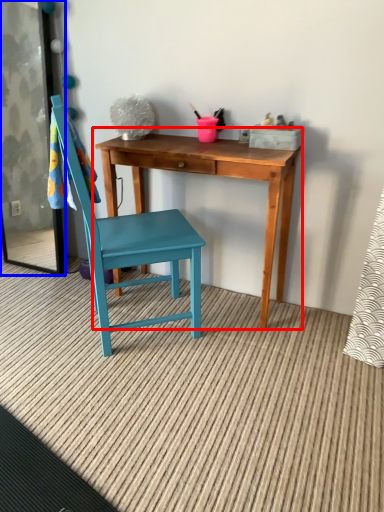
Question: Among these objects, which one is nearest to the camera, table (highlighted by a red box) or screen door (highlighted by a blue box)?

Choices:
 (A) table
 (B) screen door

Answer: (A)